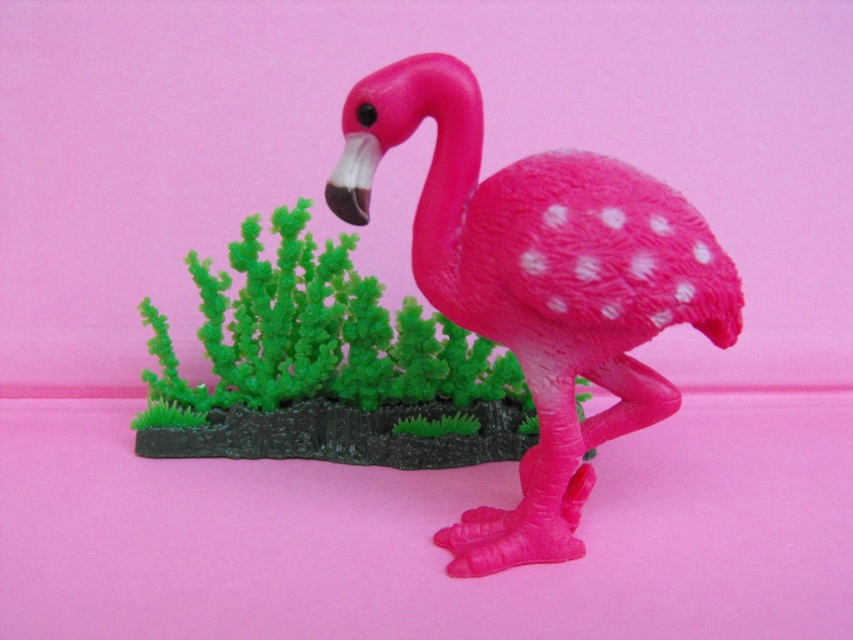
Does matte plastic flamingo at center have a lesser width compared to green matte plant at center?

Yes, matte plastic flamingo at center is thinner than green matte plant at center.

Does point (653, 422) come in front of point (224, 369)?

Yes.

Who is more distant from viewer, (408,104) or (317,328)?

The point (317,328) is behind.

Locate an element on the screen. The width and height of the screenshot is (853, 640). matte plastic flamingo at center is located at coordinates (538, 285).